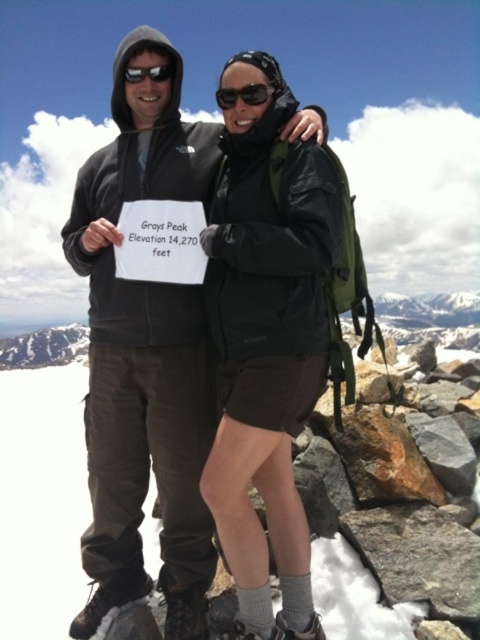
You are a photographer trying to capture the perfect shot of the white powder snow at lower center and the black plastic goggles at center. Based on their positions, which object is located to the left of the other?

The white powder snow at lower center is located to the left of the black plastic goggles at center.

You are planning to place a 2.5 feet wide hiking mat between the matte black jacket at center and the white powder snow at lower center. Considering their widths, will the mat fit between them without overlapping?

The matte black jacket at center is narrower than the white powder snow at lower center. Since the mat is 2.5 feet wide, it can fit between them without overlapping as there is sufficient space.